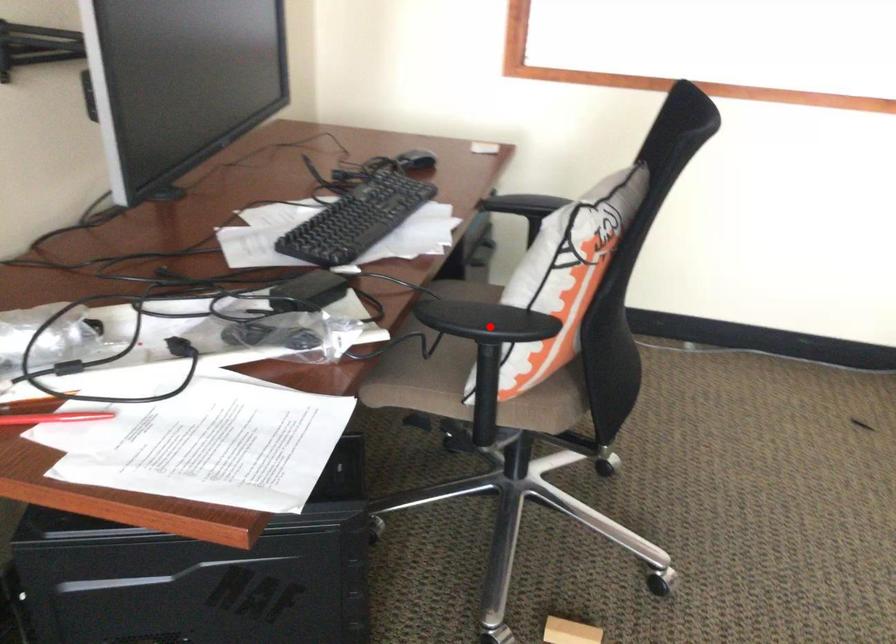
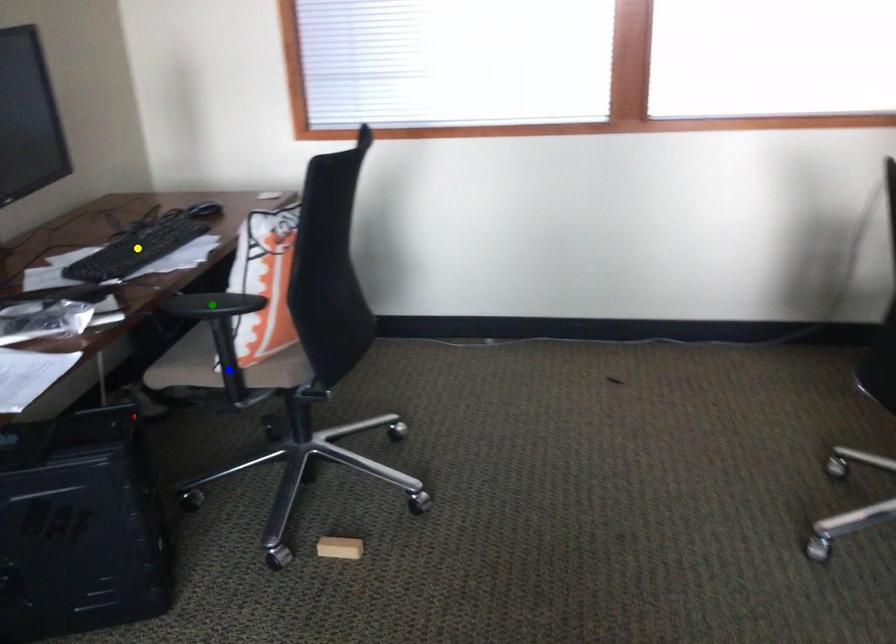
Question: I am providing you with two images of the same scene from different viewpoints. A red point is marked on the first image. You are given multiple points on the second image. Which spot in image 2 lines up with the point in image 1?

Choices:
 (A) green point
 (B) blue point
 (C) yellow point

Answer: (A)